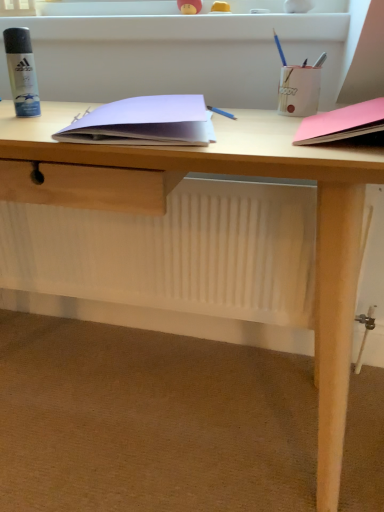
Question: Should I look upward or downward to see matte white pencil holder at upper right, the 2th stationery in the right-to-left sequence?

Choices:
 (A) up
 (B) down

Answer: (A)

Question: Is metallic silver pen at upper right, which is counted as the first stationery, starting from the right, aimed at blue pencil at upper right, the 2th stationery in the left-to-right sequence?

Choices:
 (A) yes
 (B) no

Answer: (B)

Question: Is blue pencil at upper right, the 2th stationery in the left-to-right sequence, at the back of metallic silver pen at upper right, the fourth stationery positioned from the left?

Choices:
 (A) no
 (B) yes

Answer: (A)

Question: Can you confirm if metallic silver pen at upper right, which is counted as the first stationery, starting from the right, is positioned to the right of blue pencil at upper right, the 2th stationery in the left-to-right sequence?

Choices:
 (A) yes
 (B) no

Answer: (A)

Question: Considering the relative sizes of metallic silver pen at upper right, which is counted as the first stationery, starting from the right, and blue pencil at upper right, placed as the 3th stationery when sorted from right to left, in the image provided, is metallic silver pen at upper right, which is counted as the first stationery, starting from the right, shorter than blue pencil at upper right, placed as the 3th stationery when sorted from right to left,?

Choices:
 (A) yes
 (B) no

Answer: (A)

Question: Does metallic silver pen at upper right, which is counted as the first stationery, starting from the right, come behind blue pencil at upper right, placed as the 3th stationery when sorted from right to left?

Choices:
 (A) yes
 (B) no

Answer: (A)

Question: From the image's perspective, is metallic silver pen at upper right, the fourth stationery positioned from the left, above blue pencil at upper right, placed as the 3th stationery when sorted from right to left?

Choices:
 (A) no
 (B) yes

Answer: (A)

Question: Considering the relative sizes of white paper at center, the second paperback book from the right, and matte black spray can at left, which is counted as the 4th stationery, starting from the right, in the image provided, is white paper at center, the second paperback book from the right, taller than matte black spray can at left, which is counted as the 4th stationery, starting from the right,?

Choices:
 (A) yes
 (B) no

Answer: (B)

Question: Is white paper at center, arranged as the first paperback book when viewed from the left, bigger than matte black spray can at left, which is counted as the 4th stationery, starting from the right?

Choices:
 (A) no
 (B) yes

Answer: (B)

Question: Is white paper at center, arranged as the first paperback book when viewed from the left, in front of matte black spray can at left, which is counted as the 4th stationery, starting from the right?

Choices:
 (A) yes
 (B) no

Answer: (A)

Question: From a real-world perspective, is white paper at center, the second paperback book from the right, on matte black spray can at left, the 1th stationery in the left-to-right sequence?

Choices:
 (A) no
 (B) yes

Answer: (A)

Question: Is white paper at center, arranged as the first paperback book when viewed from the left, beside matte black spray can at left, the 1th stationery in the left-to-right sequence?

Choices:
 (A) yes
 (B) no

Answer: (B)

Question: Is white paper at center, the second paperback book from the right, aimed at matte black spray can at left, which is counted as the 4th stationery, starting from the right?

Choices:
 (A) yes
 (B) no

Answer: (B)

Question: Does blue pencil at upper right, the 2th stationery in the left-to-right sequence, touch matte white pencil holder at upper right, the 3th stationery from the left?

Choices:
 (A) no
 (B) yes

Answer: (A)